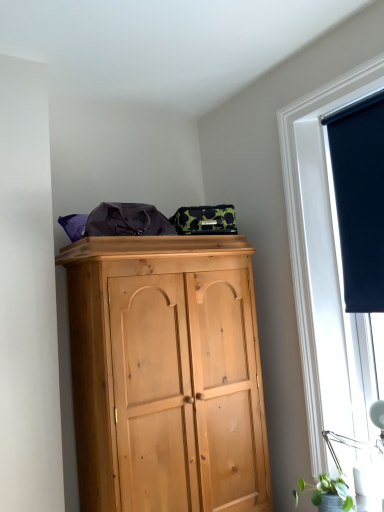
Question: From the image's perspective, is dark blue fabric at upper right over matte black roller blind at right?

Choices:
 (A) no
 (B) yes

Answer: (B)

Question: Does dark blue fabric at upper right have a larger size compared to matte black roller blind at right?

Choices:
 (A) yes
 (B) no

Answer: (B)

Question: From a real-world perspective, is dark blue fabric at upper right beneath matte black roller blind at right?

Choices:
 (A) no
 (B) yes

Answer: (A)

Question: Is dark blue fabric at upper right at the right side of matte black roller blind at right?

Choices:
 (A) no
 (B) yes

Answer: (B)

Question: From the image's perspective, is dark blue fabric at upper right below matte black roller blind at right?

Choices:
 (A) yes
 (B) no

Answer: (B)

Question: Is green matte plant at lower right spatially inside dark blue fabric at upper right, or outside of it?

Choices:
 (A) inside
 (B) outside

Answer: (B)

Question: From a real-world perspective, is green matte plant at lower right above or below dark blue fabric at upper right?

Choices:
 (A) below
 (B) above

Answer: (A)

Question: Based on their positions, is green matte plant at lower right located to the left or right of dark blue fabric at upper right?

Choices:
 (A) left
 (B) right

Answer: (A)

Question: In terms of size, does green matte plant at lower right appear bigger or smaller than dark blue fabric at upper right?

Choices:
 (A) small
 (B) big

Answer: (A)

Question: Looking at the image, does dark blue fabric at upper right seem bigger or smaller compared to matte black roller blind at right?

Choices:
 (A) big
 (B) small

Answer: (B)

Question: In the image, is dark blue fabric at upper right on the left side or the right side of matte black roller blind at right?

Choices:
 (A) right
 (B) left

Answer: (A)

Question: Is dark blue fabric at upper right taller or shorter than matte black roller blind at right?

Choices:
 (A) short
 (B) tall

Answer: (A)

Question: Looking at their shapes, would you say dark blue fabric at upper right is wider or thinner than matte black roller blind at right?

Choices:
 (A) wide
 (B) thin

Answer: (B)

Question: Is matte black roller blind at right inside the boundaries of dark blue fabric at upper right, or outside?

Choices:
 (A) outside
 (B) inside

Answer: (A)

Question: Is point (336, 451) closer or farther from the camera than point (372, 302)?

Choices:
 (A) closer
 (B) farther

Answer: (A)